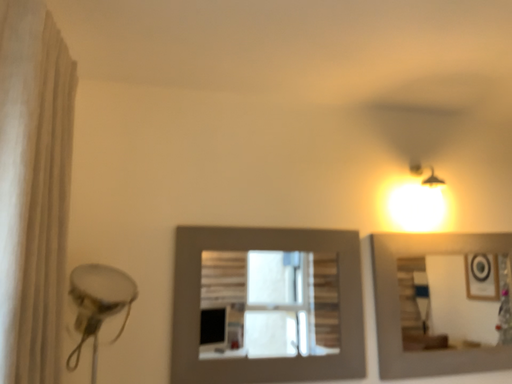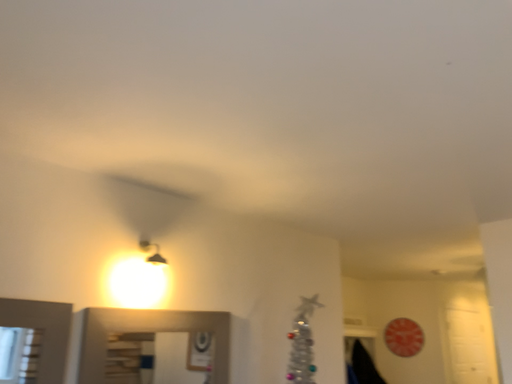
Question: Which way did the camera rotate in the video?

Choices:
 (A) rotated left
 (B) rotated right

Answer: (B)